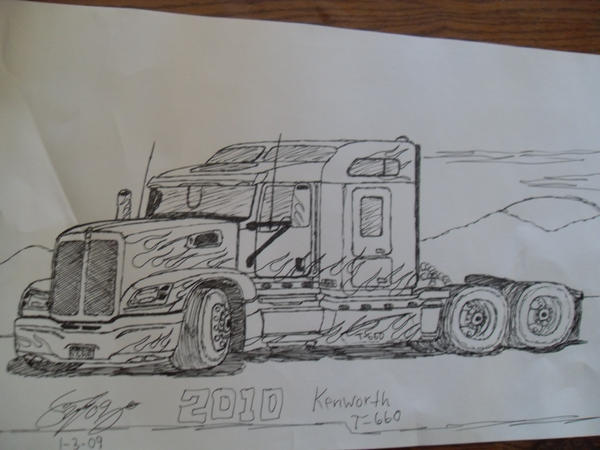
Find the location of a particular element. The image size is (600, 450). grate is located at coordinates (102, 271).